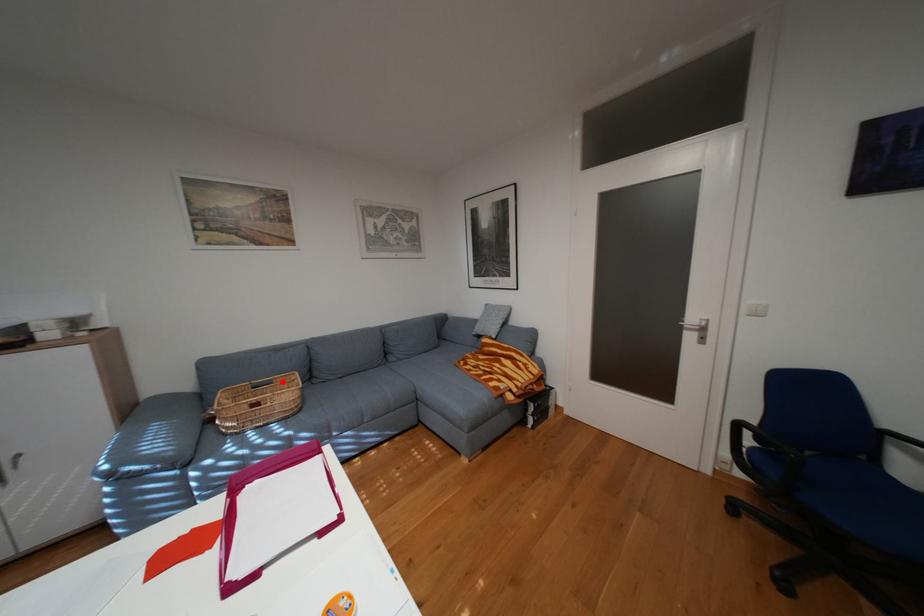
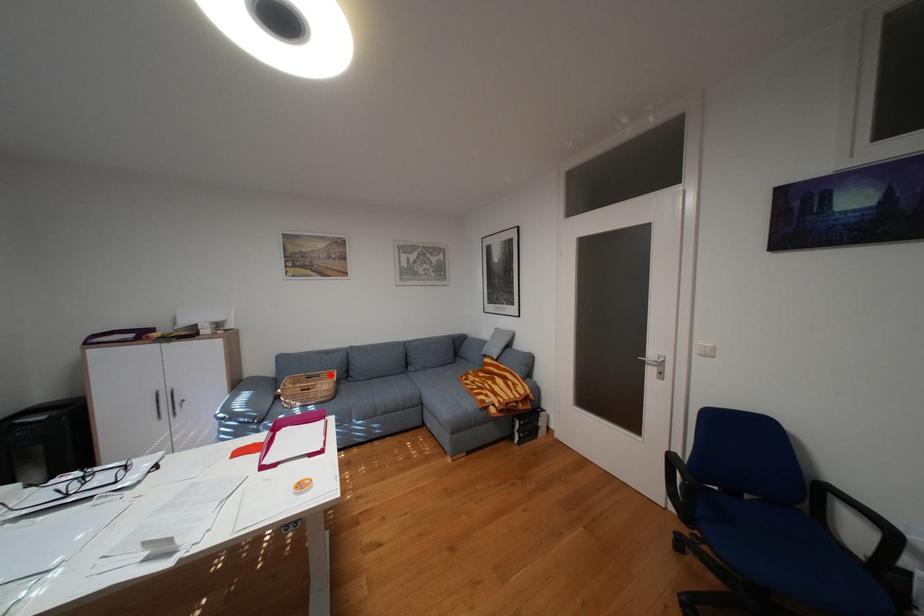
I am providing you with two images of the same scene from different viewpoints. A red point is marked on the first image and another point is marked on the second image. Does the point marked in image1 correspond to the same location as the one in image2?

Yes